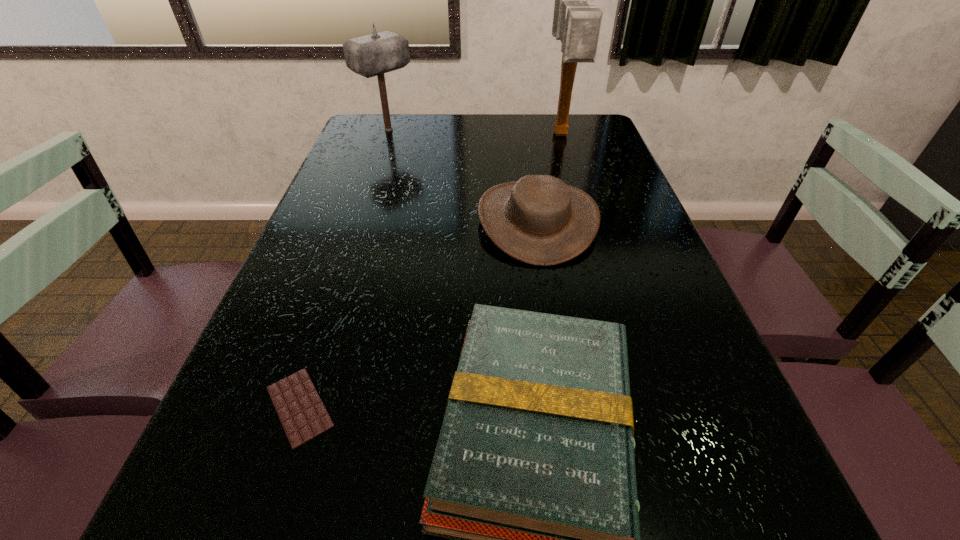
In order to click on mallet at the left edge in this screenshot , I will do `click(372, 55)`.

The image size is (960, 540). What are the coordinates of `chocolate bar that is at the left edge` in the screenshot? It's located at (303, 416).

Where is `mallet that is at the right edge`? The image size is (960, 540). mallet that is at the right edge is located at coordinates (576, 24).

The image size is (960, 540). I want to click on cowboy hat positioned at the right edge, so click(x=540, y=220).

You are a GUI agent. You are given a task and a screenshot of the screen. Output one action in this format:
    pyautogui.click(x=<x>, y=<y>)
    Task: Click on the object that is at the far left corner
    
    Given the screenshot: What is the action you would take?
    pyautogui.click(x=372, y=55)

Locate an element on the screen. This screenshot has width=960, height=540. object that is at the far right corner is located at coordinates (576, 24).

This screenshot has width=960, height=540. In the image, there is a desktop. Identify the location of vacant space at the far edge. (429, 127).

The image size is (960, 540). Identify the location of vacant space at the left edge of the desktop. (253, 393).

Where is `vacant space at the right edge of the desktop`? vacant space at the right edge of the desktop is located at coordinates (647, 342).

The height and width of the screenshot is (540, 960). I want to click on vacant space at the far right corner of the desktop, so click(584, 123).